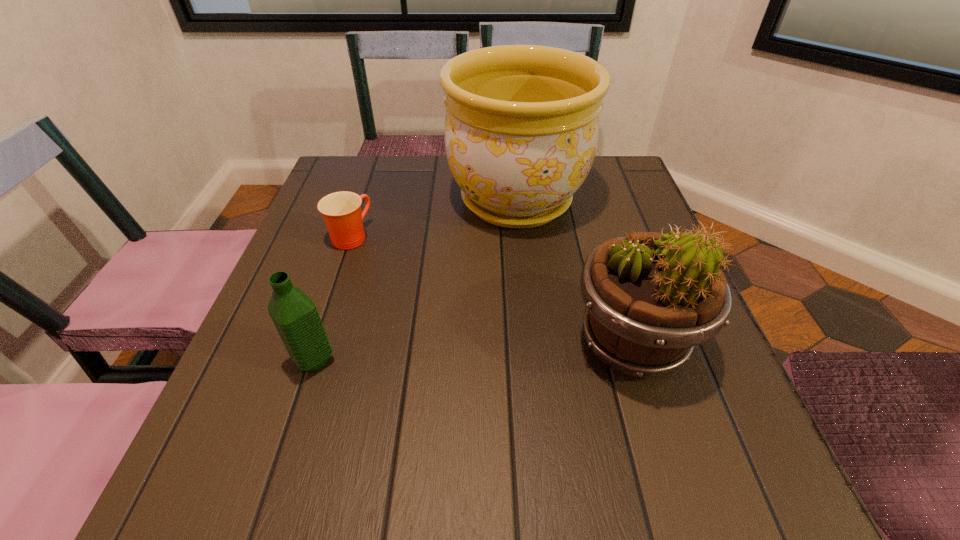
This screenshot has height=540, width=960. I want to click on cup that is positioned at the left edge, so click(341, 211).

Identify the location of object situated at the far right corner. (521, 129).

The width and height of the screenshot is (960, 540). I want to click on free space at the near edge, so click(376, 503).

Identify the location of vacant space at the left edge of the desktop. The height and width of the screenshot is (540, 960). (295, 259).

In order to click on blank area at the right edge in this screenshot , I will do `click(588, 209)`.

This screenshot has height=540, width=960. I want to click on free space at the far right corner of the desktop, so click(591, 176).

I want to click on free region at the near right corner of the desktop, so click(x=657, y=468).

The width and height of the screenshot is (960, 540). Find the location of `free space between the nearer flowerpot and the water bottle`. free space between the nearer flowerpot and the water bottle is located at coordinates (473, 352).

This screenshot has width=960, height=540. In order to click on free space between the water bottle and the shortest object in this screenshot , I will do `click(332, 298)`.

The image size is (960, 540). Find the location of `free point between the farther flowerpot and the shortest object`. free point between the farther flowerpot and the shortest object is located at coordinates (433, 218).